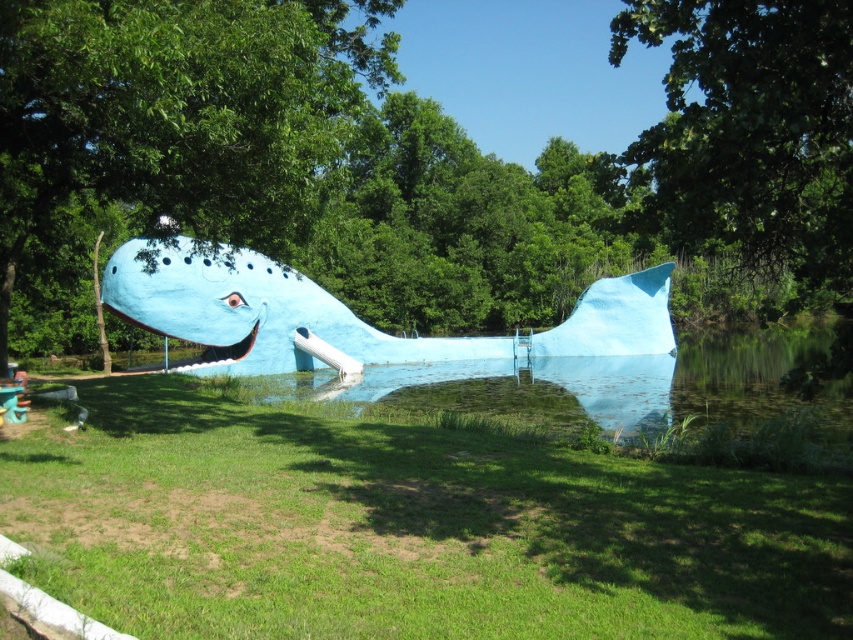
In the scene shown: Can you confirm if green grass at lower center is positioned to the right of blue smooth pond at center?

In fact, green grass at lower center is to the left of blue smooth pond at center.

Does green grass at lower center have a smaller size compared to blue smooth pond at center?

Yes, green grass at lower center is smaller than blue smooth pond at center.

Identify the location of green grass at lower center. (405, 529).

The height and width of the screenshot is (640, 853). What are the coordinates of `green grass at lower center` in the screenshot? It's located at (405, 529).

How distant is green grass at lower center from blue matte whale at center?

green grass at lower center and blue matte whale at center are 9.09 meters apart from each other.

Does green grass at lower center have a greater height compared to blue matte whale at center?

In fact, green grass at lower center may be shorter than blue matte whale at center.

Does point (474, 458) come closer to viewer compared to point (415, 356)?

Yes.

Where is `green grass at lower center`? green grass at lower center is located at coordinates (405, 529).

Between point (688, 342) and point (285, 278), which one is positioned behind?

The point (688, 342) is behind.

Does point (648, 400) come in front of point (527, 342)?

That is True.

Where is `blue smooth pond at center`? The image size is (853, 640). blue smooth pond at center is located at coordinates (622, 385).